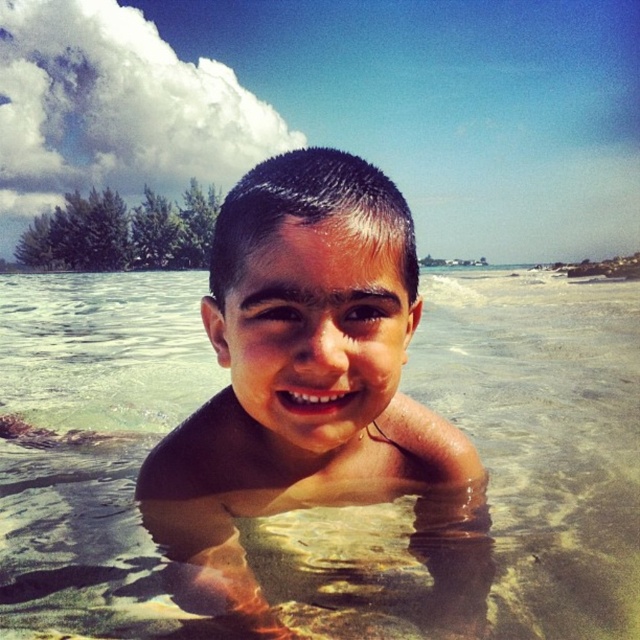
Is clear water at center taller than smooth skin child at center?

Indeed, clear water at center has a greater height compared to smooth skin child at center.

This screenshot has width=640, height=640. Find the location of `clear water at center`. clear water at center is located at coordinates click(492, 480).

Is point (500, 336) positioned in front of point (412, 460)?

No, it is behind (412, 460).

Where is `clear water at center`? The image size is (640, 640). clear water at center is located at coordinates (492, 480).